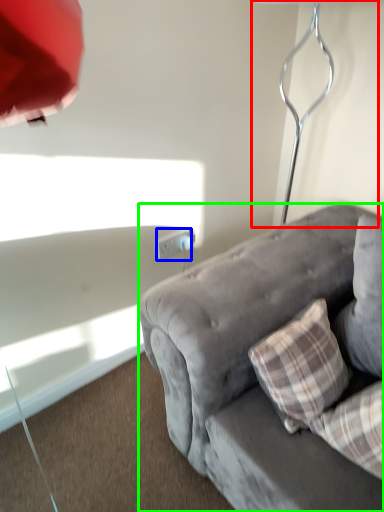
Question: Which object is the farthest from table lamp (highlighted by a red box)? Choose among these: power outlet (highlighted by a blue box) or studio couch (highlighted by a green box).

Choices:
 (A) power outlet
 (B) studio couch

Answer: (A)